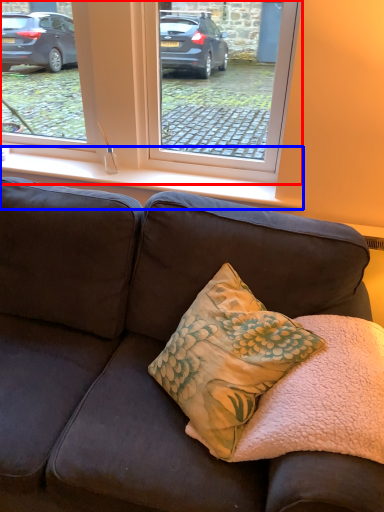
Question: Which point is closer to the camera, window (highlighted by a red box) or window sill (highlighted by a blue box)?

Choices:
 (A) window
 (B) window sill

Answer: (A)